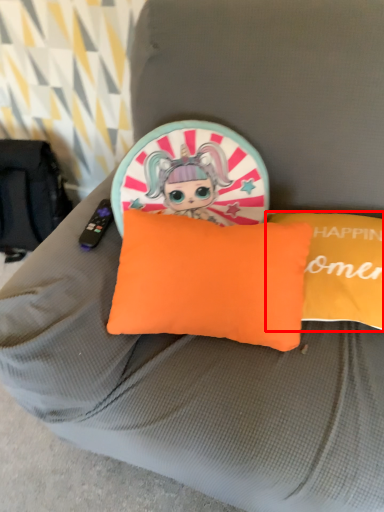
Question: Considering the relative positions of pillow (annotated by the red box) and pillow in the image provided, where is pillow (annotated by the red box) located with respect to the staircase?

Choices:
 (A) left
 (B) right

Answer: (B)